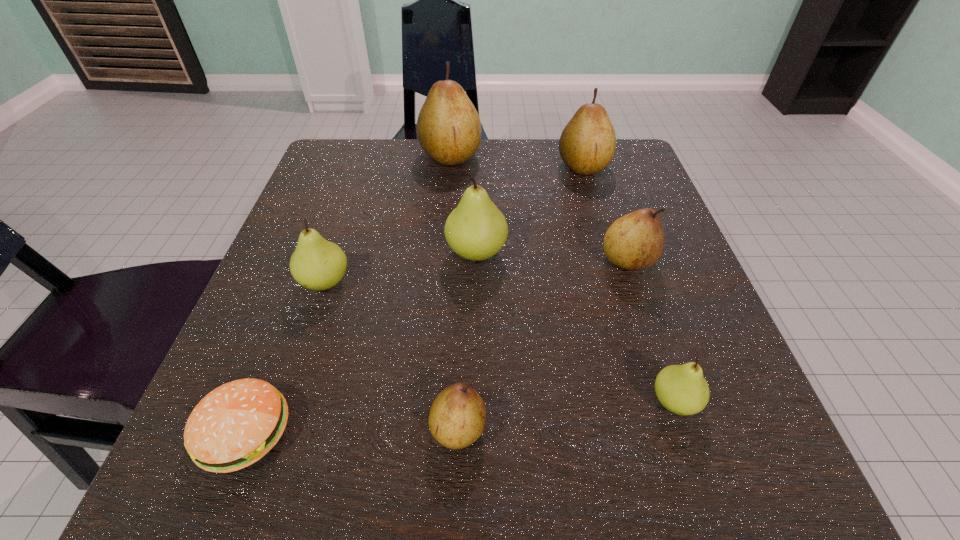
At what (x,y) coordinates should I click in order to perform the action: click on the tallest object. Please return your answer as a coordinate pair (x, y). The image size is (960, 540). Looking at the image, I should click on (449, 130).

This screenshot has height=540, width=960. Identify the location of the tallest pear. (449, 130).

Locate an element on the screen. the third smallest brown pear is located at coordinates (587, 144).

Identify the location of the second green pear from left to right. (476, 230).

Locate an element on the screen. The width and height of the screenshot is (960, 540). the leftmost pear is located at coordinates (317, 264).

Find the location of a particular element. This screenshot has width=960, height=540. the second smallest green pear is located at coordinates (317, 264).

Image resolution: width=960 pixels, height=540 pixels. In order to click on the second smallest brown pear in this screenshot , I will do `click(635, 241)`.

The height and width of the screenshot is (540, 960). I want to click on the smallest green pear, so click(x=682, y=389).

Locate an element on the screen. This screenshot has height=540, width=960. the rightmost green pear is located at coordinates (682, 389).

This screenshot has height=540, width=960. I want to click on the smallest brown pear, so click(x=457, y=418).